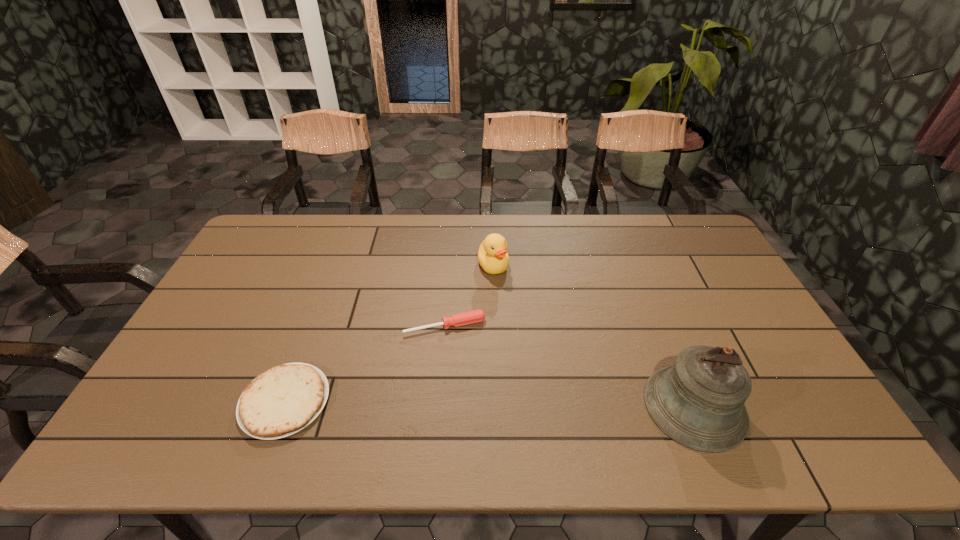
Find the location of a particular element. free region at the right edge of the desktop is located at coordinates (707, 276).

Find the location of a particular element. This screenshot has height=540, width=960. vacant region at the far left corner of the desktop is located at coordinates (289, 214).

Locate an element on the screen. The image size is (960, 540). blank space at the far right corner of the desktop is located at coordinates (679, 246).

Image resolution: width=960 pixels, height=540 pixels. I want to click on free space between the leftmost object and the second farthest object, so click(x=365, y=363).

At what (x,y) coordinates should I click in order to perform the action: click on unoccupied position between the leftmost object and the second farthest object. Please return your answer as a coordinate pair (x, y). Looking at the image, I should click on (365, 363).

Where is `blank region between the duck and the bell`? This screenshot has height=540, width=960. blank region between the duck and the bell is located at coordinates (594, 336).

Identify the location of free spot between the leftmost object and the bell. This screenshot has height=540, width=960. (490, 404).

Find the location of a particular element. The image size is (960, 540). vacant area that lies between the second farthest object and the leftmost object is located at coordinates (365, 363).

Where is `free space between the leftmost object and the third nearest object`? free space between the leftmost object and the third nearest object is located at coordinates (365, 363).

The width and height of the screenshot is (960, 540). I want to click on blank region between the second tallest object and the tallest object, so click(594, 336).